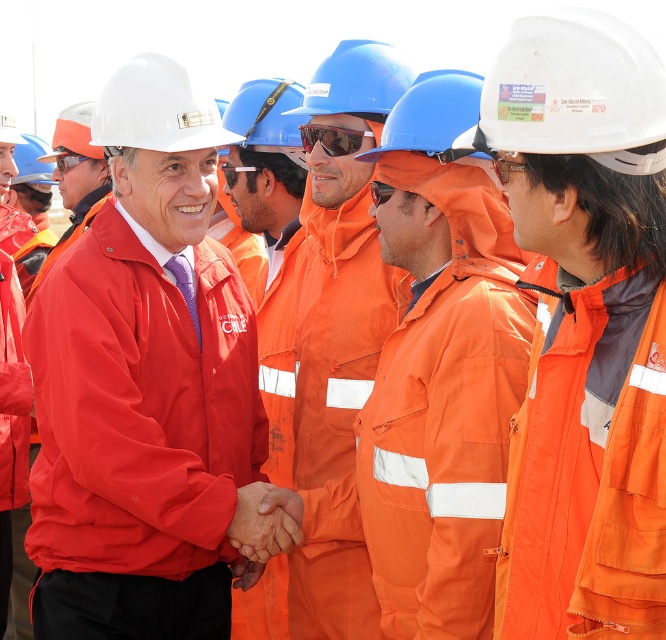
Question: Which point is closer to the camera?

Choices:
 (A) (400, 65)
 (B) (93, 556)
 (C) (587, 128)

Answer: (C)

Question: Which object is the closest to the matte orange hard hat at left?

Choices:
 (A) orange matte safety goggles at center
 (B) orange fabric uniform at center

Answer: (A)

Question: Which point appears closest to the camera in this image?

Choices:
 (A) (115, 83)
 (B) (334, 148)

Answer: (A)

Question: Does matte orange hard hat at left appear on the left side of sunglassesreflectiveobject at center?

Choices:
 (A) yes
 (B) no

Answer: (A)

Question: Is orange matte hard hat at center closer to camera compared to sunglassesreflectiveobject at center?

Choices:
 (A) no
 (B) yes

Answer: (B)

Question: Does orange fabric uniform at center appear on the left side of white matte hard hat at upper center?

Choices:
 (A) yes
 (B) no

Answer: (A)